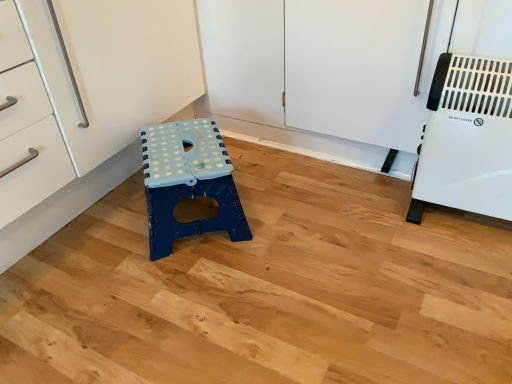
Question: Would you say white plastic heater at right is inside or outside blue plastic stool at center?

Choices:
 (A) inside
 (B) outside

Answer: (B)

Question: From a real-world perspective, is white plastic heater at right positioned above or below blue plastic stool at center?

Choices:
 (A) above
 (B) below

Answer: (A)

Question: Considering the positions of point [x=501, y=76] and point [x=147, y=187], is point [x=501, y=76] closer or farther from the camera than point [x=147, y=187]?

Choices:
 (A) closer
 (B) farther

Answer: (A)

Question: From a real-world perspective, relative to white plastic heater at right, is blue plastic stool at center vertically above or below?

Choices:
 (A) above
 (B) below

Answer: (B)

Question: Considering the positions of blue plastic stool at center and white plastic heater at right in the image, is blue plastic stool at center wider or thinner than white plastic heater at right?

Choices:
 (A) thin
 (B) wide

Answer: (B)

Question: Is blue plastic stool at center inside the boundaries of white plastic heater at right, or outside?

Choices:
 (A) inside
 (B) outside

Answer: (B)

Question: From the image's perspective, is blue plastic stool at center positioned above or below white plastic heater at right?

Choices:
 (A) below
 (B) above

Answer: (A)